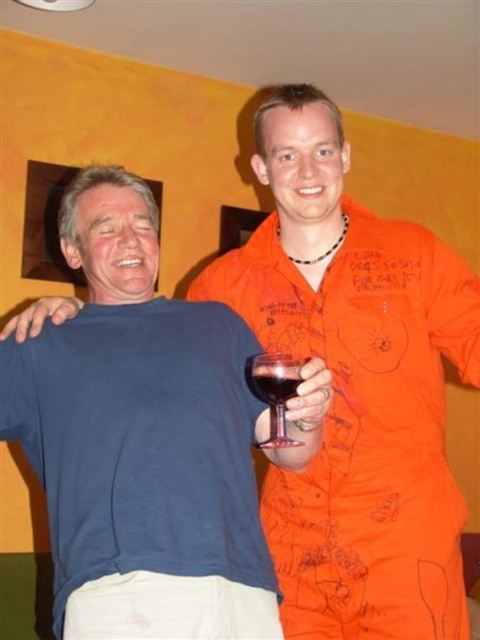
Which of these two, transparent glass at right or translucent glass at upper center, stands taller?

transparent glass at right is taller.

Is point (285, 445) more distant than point (274, 378)?

Yes, point (285, 445) is behind point (274, 378).

You are a GUI agent. You are given a task and a screenshot of the screen. Output one action in this format:
    pyautogui.click(x=<x>, y=<y>)
    Task: Click on the transparent glass at right
    
    Given the screenshot: What is the action you would take?
    point(275,392)